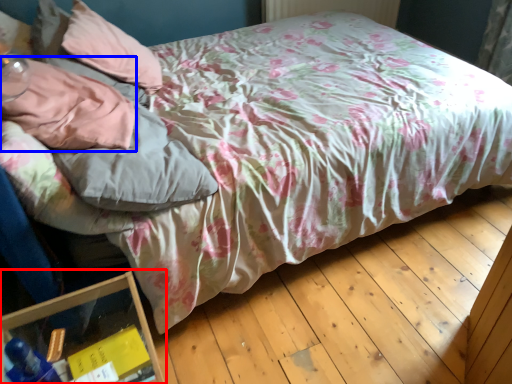
Question: Which point is closer to the camera, glass box (highlighted by a red box) or pillow (highlighted by a blue box)?

Choices:
 (A) glass box
 (B) pillow

Answer: (A)